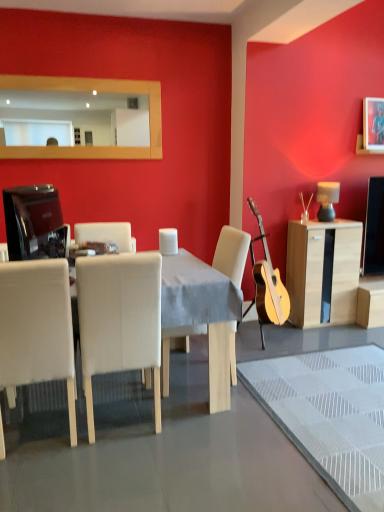
Question: Considering the relative sizes of matte black television at left and matte black lamp at right in the image provided, is matte black television at left smaller than matte black lamp at right?

Choices:
 (A) no
 (B) yes

Answer: (A)

Question: From the image's perspective, is matte black television at left over matte black lamp at right?

Choices:
 (A) yes
 (B) no

Answer: (B)

Question: Is matte black television at left far from matte black lamp at right?

Choices:
 (A) yes
 (B) no

Answer: (A)

Question: Can you confirm if matte black television at left is taller than matte black lamp at right?

Choices:
 (A) no
 (B) yes

Answer: (B)

Question: Could you tell me if matte black television at left is turned towards matte black lamp at right?

Choices:
 (A) yes
 (B) no

Answer: (B)

Question: Is matte black television at left to the left of matte black lamp at right from the viewer's perspective?

Choices:
 (A) yes
 (B) no

Answer: (A)

Question: Considering the relative sizes of light wood cabinet at right and matte black television at left in the image provided, is light wood cabinet at right thinner than matte black television at left?

Choices:
 (A) no
 (B) yes

Answer: (A)

Question: From the image's perspective, is light wood cabinet at right above matte black television at left?

Choices:
 (A) yes
 (B) no

Answer: (B)

Question: Is the position of light wood cabinet at right more distant than that of matte black television at left?

Choices:
 (A) yes
 (B) no

Answer: (A)

Question: Are light wood cabinet at right and matte black television at left located far from each other?

Choices:
 (A) yes
 (B) no

Answer: (A)

Question: Is the depth of light wood cabinet at right less than that of matte black television at left?

Choices:
 (A) no
 (B) yes

Answer: (A)

Question: Is light wood cabinet at right next to matte black television at left?

Choices:
 (A) yes
 (B) no

Answer: (B)

Question: Is matte black television at left further to camera compared to wooden frame mirror at upper center?

Choices:
 (A) yes
 (B) no

Answer: (B)